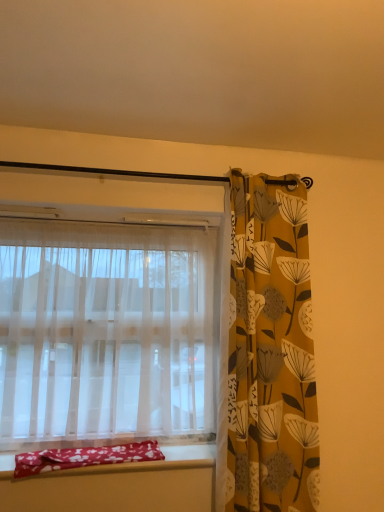
Question: In the image, is yellow floral fabric curtain at right, the 2th curtain viewed from the left, positioned in front of or behind red fabric pillow at lower left?

Choices:
 (A) behind
 (B) front

Answer: (B)

Question: Based on their sizes in the image, would you say yellow floral fabric curtain at right, the 2th curtain viewed from the left, is bigger or smaller than red fabric pillow at lower left?

Choices:
 (A) small
 (B) big

Answer: (B)

Question: Which object is the closest to the red fabric pillow at lower left?

Choices:
 (A) yellow floral fabric curtain at right, the 2th curtain viewed from the left
 (B) sheer white curtain at left, which appears as the first curtain when viewed from the left

Answer: (B)

Question: Which object is positioned closest to the yellow floral fabric curtain at right, the 2th curtain viewed from the left?

Choices:
 (A) red fabric pillow at lower left
 (B) sheer white curtain at left, which appears as the first curtain when viewed from the left

Answer: (B)